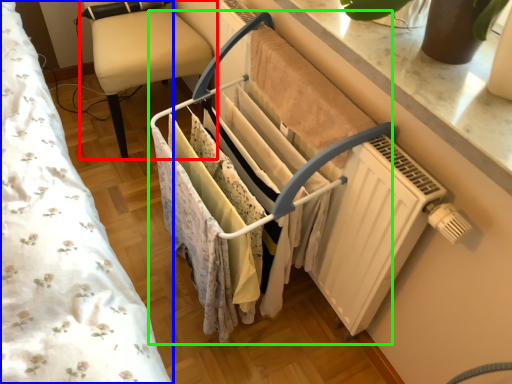
Question: Which is nearer to the furniture (highlighted by a red box)? bed (highlighted by a blue box) or closet (highlighted by a green box).

Choices:
 (A) bed
 (B) closet

Answer: (A)